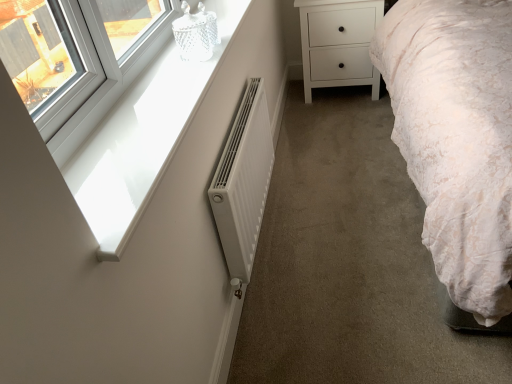
Identify the location of white matte chest of drawers at center. (338, 43).

Describe the element at coordinates (338, 43) in the screenshot. I see `white matte chest of drawers at center` at that location.

Describe the element at coordinates (77, 52) in the screenshot. I see `white glossy window sill at upper left` at that location.

Measure the distance between point (x=260, y=190) and camera.

Point (x=260, y=190) and camera are 1.76 meters apart.

The image size is (512, 384). I want to click on white matte chest of drawers at center, so click(x=338, y=43).

Between point (368, 41) and point (240, 275), which one is positioned behind?

The point (368, 41) is behind.

Can you confirm if white matte chest of drawers at center is thinner than white matte radiator at center?

Incorrect, the width of white matte chest of drawers at center is not less than that of white matte radiator at center.

Find the location of `radiator above the white matte chest of drawers at center (from a real-world perspective)`. radiator above the white matte chest of drawers at center (from a real-world perspective) is located at coordinates (243, 181).

Is white matte chest of drawers at center next to white matte radiator at center?

No, white matte chest of drawers at center is not making contact with white matte radiator at center.

Considering the sizes of white glossy window sill at upper left and white matte chest of drawers at center in the image, is white glossy window sill at upper left wider or thinner than white matte chest of drawers at center?

In the image, white glossy window sill at upper left appears to be more narrow than white matte chest of drawers at center.

Considering the positions of point (97, 208) and point (322, 84), is point (97, 208) closer or farther from the camera than point (322, 84)?

Point (97, 208).

Is white glossy window sill at upper left taller than white matte chest of drawers at center?

Incorrect, the height of white glossy window sill at upper left is not larger of that of white matte chest of drawers at center.

From the image's perspective, between white glossy window sill at upper left and white matte chest of drawers at center, which one is located above?

white matte chest of drawers at center, from the image's perspective.

Identify the location of the chest of drawers located underneath the white glossy window sill at upper left (from a real-world perspective). The height and width of the screenshot is (384, 512). point(338,43).

From the image's perspective, which is below, white matte chest of drawers at center or white glossy window sill at upper left?

white glossy window sill at upper left is shown below in the image.

Is the surface of white matte chest of drawers at center in direct contact with white glossy window sill at upper left?

They are not placed beside each other.

Which point is more forward, (373, 19) or (22, 99)?

Positioned in front is point (22, 99).

Does white glossy window sill at upper left have a lesser width compared to white glossy window sill at upper left?

Yes.

At what (x,y) coordinates should I click in order to perform the action: click on window that is above the white glossy window sill at upper left (from the image's perspective). Please return your answer as a coordinate pair (x, y). Image resolution: width=512 pixels, height=384 pixels. Looking at the image, I should click on (77, 52).

Is white glossy window sill at upper left taller than white glossy window sill at upper left?

Correct, white glossy window sill at upper left is much taller as white glossy window sill at upper left.

Does white glossy window sill at upper left have a larger size compared to white glossy window sill at upper left?

Indeed, white glossy window sill at upper left has a larger size compared to white glossy window sill at upper left.

Is white glossy window sill at upper left inside the boundaries of white matte chest of drawers at center, or outside?

white glossy window sill at upper left is outside white matte chest of drawers at center.

How many degrees apart are the facing directions of white glossy window sill at upper left and white matte chest of drawers at center?

The angular difference between white glossy window sill at upper left and white matte chest of drawers at center is 89.9 degrees.

Which is nearer, (78, 6) or (335, 18)?

The point (78, 6) is more forward.

Is white glossy window sill at upper left positioned with its back to white matte chest of drawers at center?

No, white glossy window sill at upper left's orientation is not away from white matte chest of drawers at center.

Considering the sizes of objects white glossy window sill at upper left and white glossy window sill at upper left in the image provided, who is smaller, white glossy window sill at upper left or white glossy window sill at upper left?

white glossy window sill at upper left is smaller.

Can you confirm if white glossy window sill at upper left is shorter than white glossy window sill at upper left?

Indeed, white glossy window sill at upper left has a lesser height compared to white glossy window sill at upper left.

Looking at this image, would you consider white glossy window sill at upper left to be distant from white glossy window sill at upper left?

That's not correct — white glossy window sill at upper left is a little close to white glossy window sill at upper left.

What's the angular difference between white matte radiator at center and white glossy window sill at upper left's facing directions?

white matte radiator at center and white glossy window sill at upper left are facing 1.22 degrees away from each other.

The image size is (512, 384). Find the location of `window above the white matte radiator at center (from a real-world perspective)`. window above the white matte radiator at center (from a real-world perspective) is located at coordinates (77, 52).

Considering the relative positions of white matte radiator at center and white glossy window sill at upper left in the image provided, is white matte radiator at center to the left or to the right of white glossy window sill at upper left?

Based on their positions, white matte radiator at center is located to the right of white glossy window sill at upper left.

Is white matte radiator at center located outside white glossy window sill at upper left?

Yes, white matte radiator at center is located beyond the bounds of white glossy window sill at upper left.

Where is `radiator above the white matte chest of drawers at center (from a real-world perspective)`? radiator above the white matte chest of drawers at center (from a real-world perspective) is located at coordinates (243, 181).

I want to click on chest of drawers above the white glossy window sill at upper left (from the image's perspective), so click(338, 43).

From the image, which object appears to be farther from white glossy window sill at upper left, white matte chest of drawers at center or white glossy window sill at upper left?

The object further to white glossy window sill at upper left is white matte chest of drawers at center.

Which object lies nearer to the anchor point white matte radiator at center, white matte chest of drawers at center or white glossy window sill at upper left?

white glossy window sill at upper left is positioned closer to the anchor white matte radiator at center.

Considering their positions, is white glossy window sill at upper left positioned closer to white matte chest of drawers at center than white matte radiator at center?

The object closer to white matte chest of drawers at center is white matte radiator at center.

Based on the photo, which object lies nearer to the anchor point white matte radiator at center, white matte chest of drawers at center or white glossy window sill at upper left?

The object closer to white matte radiator at center is white glossy window sill at upper left.

Estimate the real-world distances between objects in this image. Which object is further from white matte radiator at center, white glossy window sill at upper left or white matte chest of drawers at center?

white matte chest of drawers at center.

Estimate the real-world distances between objects in this image. Which object is closer to white glossy window sill at upper left, white glossy window sill at upper left or white matte chest of drawers at center?

Among the two, white glossy window sill at upper left is located nearer to white glossy window sill at upper left.

Based on their spatial positions, is white matte radiator at center or white glossy window sill at upper left further from white matte chest of drawers at center?

Based on the image, white glossy window sill at upper left appears to be further to white matte chest of drawers at center.

Considering their positions, is white matte radiator at center positioned further to white glossy window sill at upper left than white matte chest of drawers at center?

white matte chest of drawers at center lies further to white glossy window sill at upper left than the other object.

Locate an element on the screen. This screenshot has height=384, width=512. window sill located between white glossy window sill at upper left and white matte radiator at center in the depth direction is located at coordinates (143, 135).

At what (x,y) coordinates should I click in order to perform the action: click on radiator between white glossy window sill at upper left and white matte chest of drawers at center from front to back. Please return your answer as a coordinate pair (x, y). The image size is (512, 384). Looking at the image, I should click on (243, 181).

Identify the location of radiator between white glossy window sill at upper left and white matte chest of drawers at center along the z-axis. The width and height of the screenshot is (512, 384). (243, 181).

The width and height of the screenshot is (512, 384). What are the coordinates of `window sill located between white glossy window sill at upper left and white matte chest of drawers at center in the depth direction` in the screenshot? It's located at (143, 135).